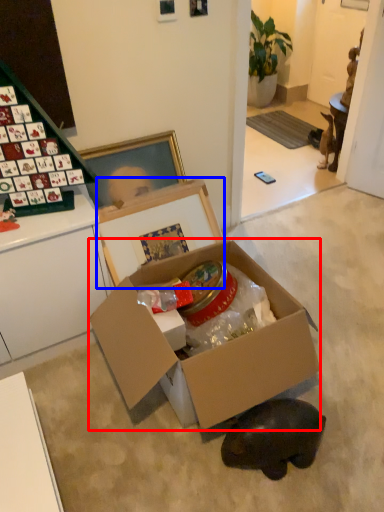
Question: Which object is further to the camera taking this photo, box (highlighted by a red box) or cardboard box (highlighted by a blue box)?

Choices:
 (A) box
 (B) cardboard box

Answer: (B)